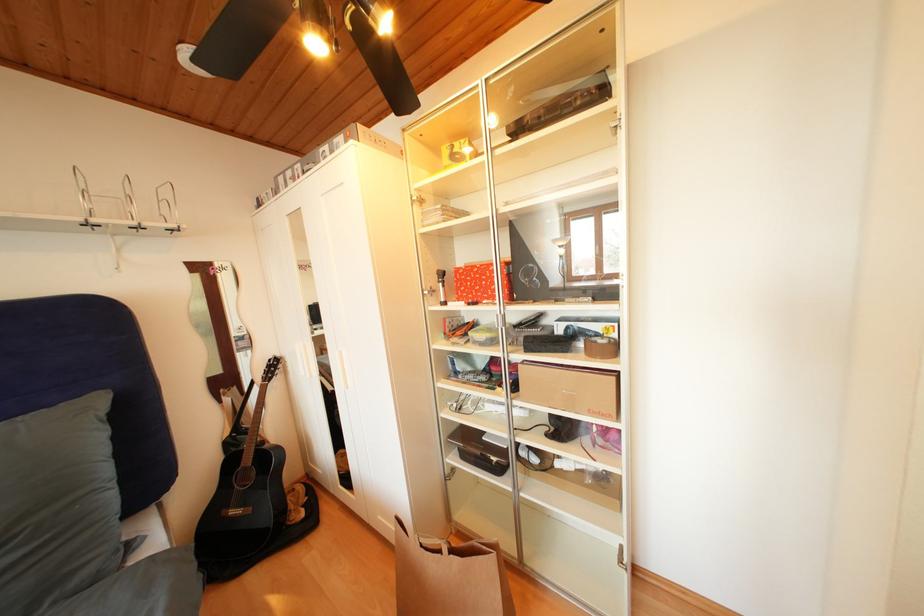
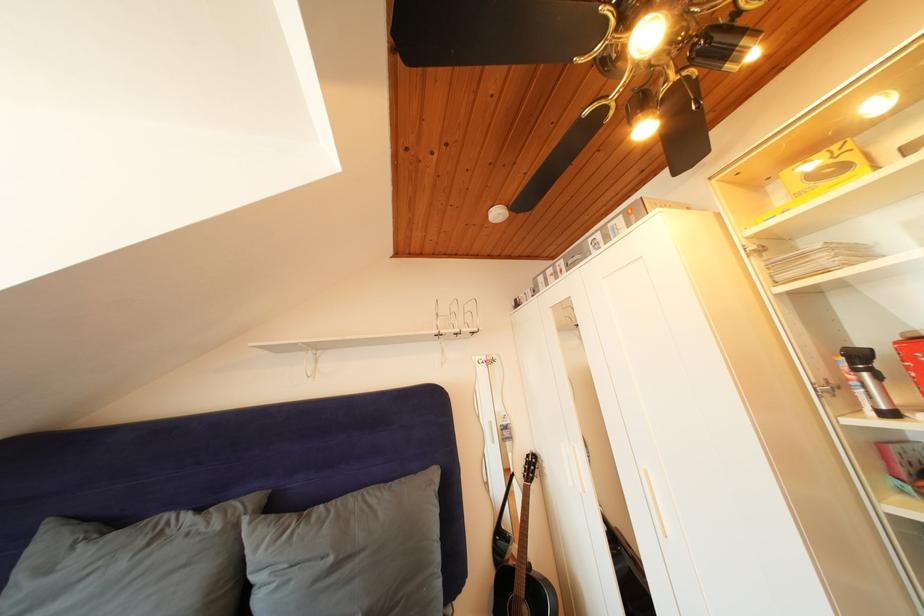
In the second image, find the point that corresponds to point 141,228 in the first image.

(466, 336)